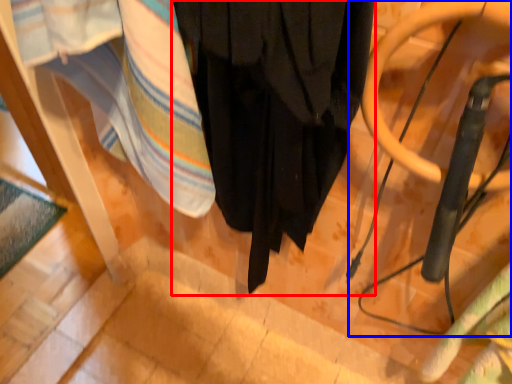
Question: Which point is closer to the camera, curtain (highlighted by a red box) or swivel chair (highlighted by a blue box)?

Choices:
 (A) curtain
 (B) swivel chair

Answer: (B)